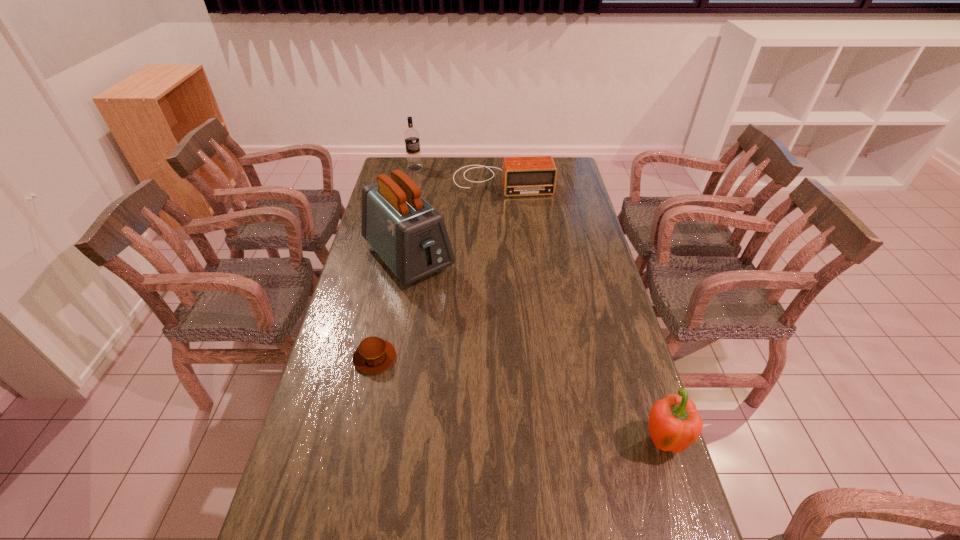
Identify the location of free location located on the label of the vodka. (430, 211).

Find the location of a particular element. vacant space situated 0.130m on the label of the vodka is located at coordinates (421, 186).

The width and height of the screenshot is (960, 540). What are the coordinates of `vacant space located on the label of the vodka` in the screenshot? It's located at (432, 214).

Identify the location of free space located 0.340m on the front-facing side of the third nearest object. The width and height of the screenshot is (960, 540). (491, 352).

I want to click on vacant region located on the front-facing side of the third nearest object, so click(443, 298).

Where is `free location located 0.210m on the front-facing side of the third nearest object`? free location located 0.210m on the front-facing side of the third nearest object is located at coordinates (467, 326).

The height and width of the screenshot is (540, 960). What are the coordinates of `vacant space situated 0.280m on the front-facing side of the radio receiver` in the screenshot? It's located at click(515, 237).

At what (x,y) coordinates should I click in order to perform the action: click on vacant region located 0.150m on the front-facing side of the radio receiver. Please return your answer as a coordinate pair (x, y). This screenshot has width=960, height=540. Looking at the image, I should click on (511, 218).

Locate an element on the screen. Image resolution: width=960 pixels, height=540 pixels. free point located 0.360m on the front-facing side of the radio receiver is located at coordinates (517, 249).

At what (x,y) coordinates should I click in order to perform the action: click on vodka situated at the far edge. Please return your answer as a coordinate pair (x, y). This screenshot has height=540, width=960. Looking at the image, I should click on (411, 136).